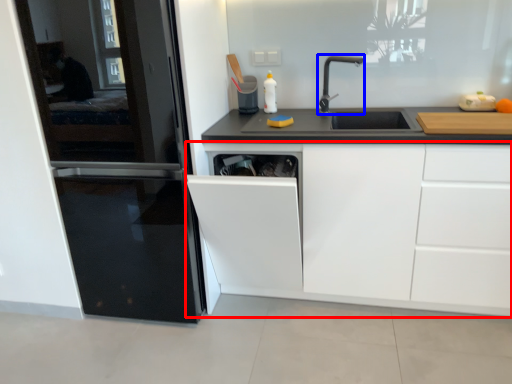
Question: Among these objects, which one is farthest to the camera, cabinetry (highlighted by a red box) or tap (highlighted by a blue box)?

Choices:
 (A) cabinetry
 (B) tap

Answer: (B)